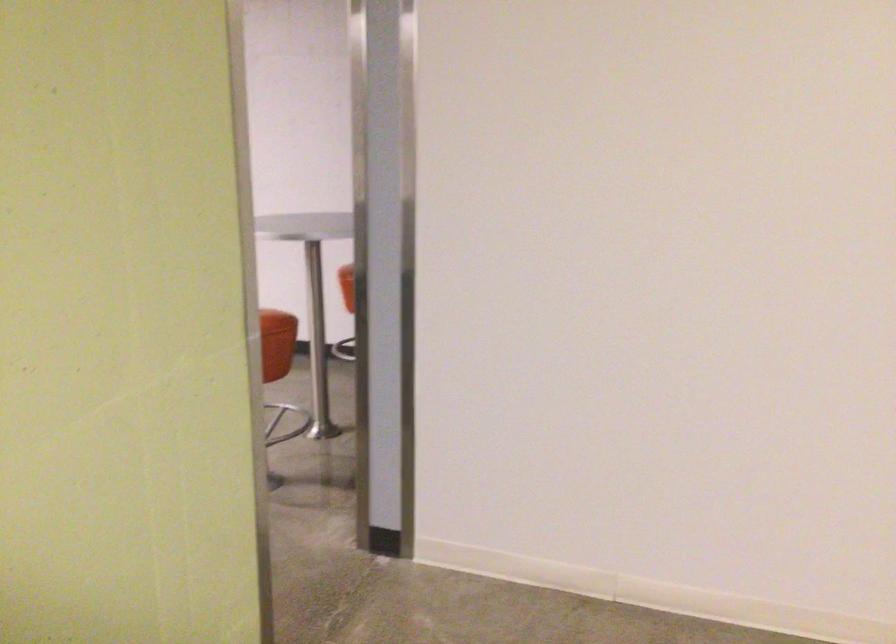
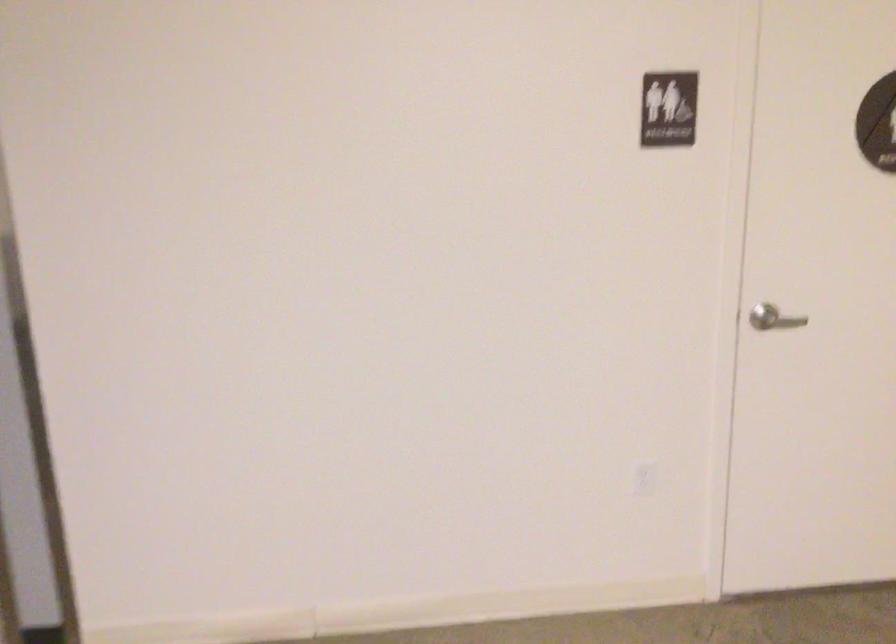
Question: The images are taken continuously from a first-person perspective. In which direction are you moving?

Choices:
 (A) Left
 (B) Right
 (C) Forward
 (D) Backward

Answer: (C)